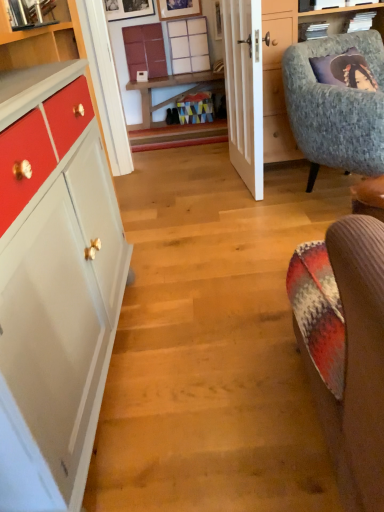
Question: Is the position of matte wood counter top at upper left less distant than that of wooden table at center?

Choices:
 (A) yes
 (B) no

Answer: (A)

Question: Considering the relative sizes of matte wood counter top at upper left and wooden table at center in the image provided, is matte wood counter top at upper left bigger than wooden table at center?

Choices:
 (A) no
 (B) yes

Answer: (A)

Question: From the image's perspective, is matte wood counter top at upper left above wooden table at center?

Choices:
 (A) no
 (B) yes

Answer: (A)

Question: Is matte wood counter top at upper left smaller than wooden table at center?

Choices:
 (A) no
 (B) yes

Answer: (B)

Question: From a real-world perspective, is matte wood counter top at upper left on top of wooden table at center?

Choices:
 (A) yes
 (B) no

Answer: (A)

Question: Considering the relative positions of matte wood counter top at upper left and wooden table at center in the image provided, is matte wood counter top at upper left to the left of wooden table at center from the viewer's perspective?

Choices:
 (A) no
 (B) yes

Answer: (B)

Question: Can you confirm if matte wood counter top at upper left is bigger than wooden picture frame at upper center, which is the first picture frame in left-to-right order?

Choices:
 (A) yes
 (B) no

Answer: (A)

Question: Are matte wood counter top at upper left and wooden picture frame at upper center, arranged as the second picture frame when viewed from the right, located far from each other?

Choices:
 (A) yes
 (B) no

Answer: (A)

Question: Is matte wood counter top at upper left at the left side of wooden picture frame at upper center, arranged as the second picture frame when viewed from the right?

Choices:
 (A) no
 (B) yes

Answer: (B)

Question: From a real-world perspective, is matte wood counter top at upper left located higher than wooden picture frame at upper center, arranged as the second picture frame when viewed from the right?

Choices:
 (A) no
 (B) yes

Answer: (A)

Question: Considering the relative sizes of matte wood counter top at upper left and wooden picture frame at upper center, arranged as the second picture frame when viewed from the right, in the image provided, is matte wood counter top at upper left smaller than wooden picture frame at upper center, arranged as the second picture frame when viewed from the right,?

Choices:
 (A) no
 (B) yes

Answer: (A)

Question: Is matte wood counter top at upper left facing towards wooden picture frame at upper center, which is the first picture frame in left-to-right order?

Choices:
 (A) yes
 (B) no

Answer: (B)

Question: Is white wooden door at center located within textured gray armchair at upper right?

Choices:
 (A) yes
 (B) no

Answer: (B)